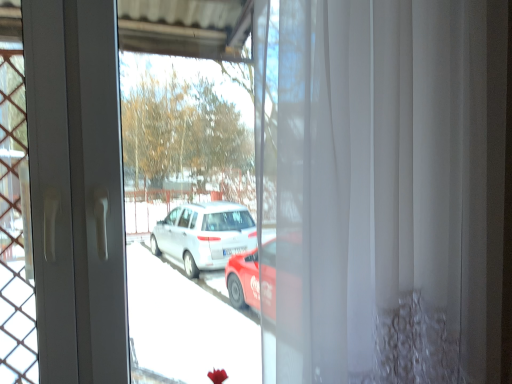
Question: Considering the positions of white sheer curtain at center and transparent plastic curtain at right in the image, is white sheer curtain at center wider or thinner than transparent plastic curtain at right?

Choices:
 (A) thin
 (B) wide

Answer: (B)

Question: Is white sheer curtain at center in front of or behind transparent plastic curtain at right in the image?

Choices:
 (A) front
 (B) behind

Answer: (A)

Question: Is point (360, 226) positioned closer to the camera than point (172, 168)?

Choices:
 (A) closer
 (B) farther

Answer: (A)

Question: From a real-world perspective, is transparent plastic curtain at right physically located above or below white sheer curtain at center?

Choices:
 (A) below
 (B) above

Answer: (A)

Question: From the image's perspective, relative to white sheer curtain at center, is transparent plastic curtain at right above or below?

Choices:
 (A) below
 (B) above

Answer: (A)

Question: Considering the positions of transparent plastic curtain at right and white sheer curtain at center in the image, is transparent plastic curtain at right bigger or smaller than white sheer curtain at center?

Choices:
 (A) small
 (B) big

Answer: (A)

Question: Considering the relative positions of transparent plastic curtain at right and white sheer curtain at center in the image provided, is transparent plastic curtain at right to the left or to the right of white sheer curtain at center?

Choices:
 (A) right
 (B) left

Answer: (B)